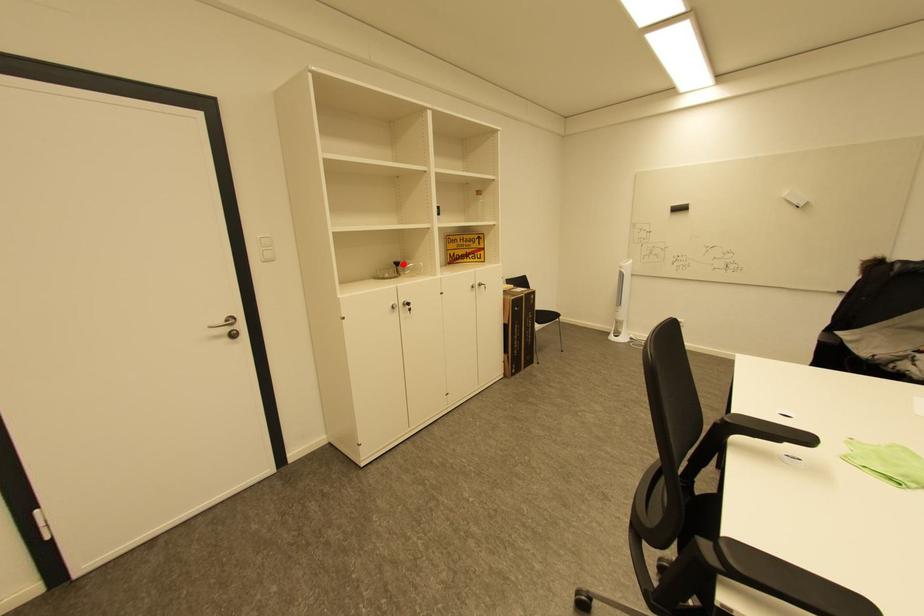
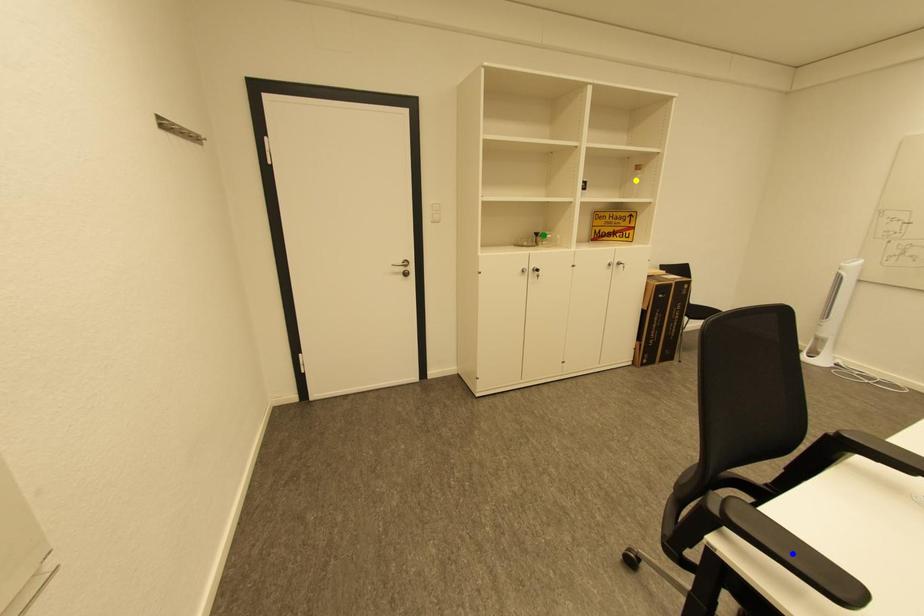
Question: I am providing you with two images of the same scene from different viewpoints. A red point is marked on the first image. You are given multiple points on the second image. Which spot in image 2 lines up with the point in image 1?

Choices:
 (A) green point
 (B) yellow point
 (C) blue point

Answer: (A)